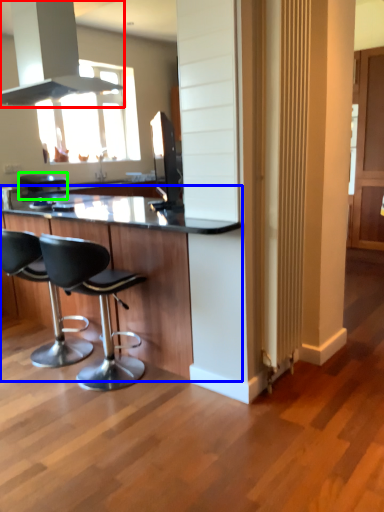
Question: Which object is positioned closest to exhaust hood (highlighted by a red box)? Select from table (highlighted by a blue box) and bar stool (highlighted by a green box).

Choices:
 (A) table
 (B) bar stool

Answer: (A)